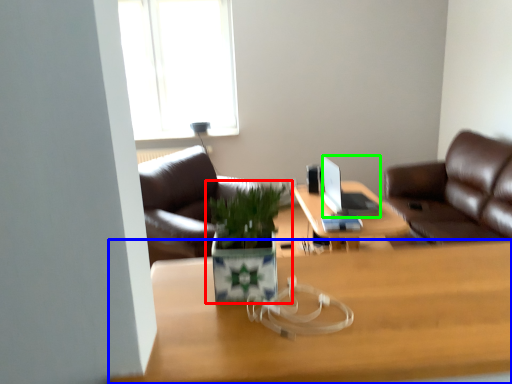
Question: Based on their relative distances, which object is farther from houseplant (highlighted by a red box)? Choose from desk (highlighted by a blue box) and laptop (highlighted by a green box).

Choices:
 (A) desk
 (B) laptop

Answer: (B)